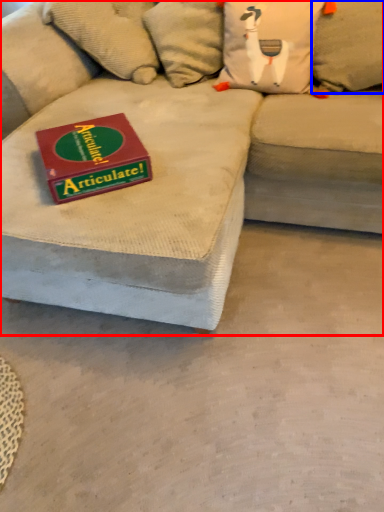
Question: Which of the following is the farthest to the observer, studio couch (highlighted by a red box) or pillow (highlighted by a blue box)?

Choices:
 (A) studio couch
 (B) pillow

Answer: (B)